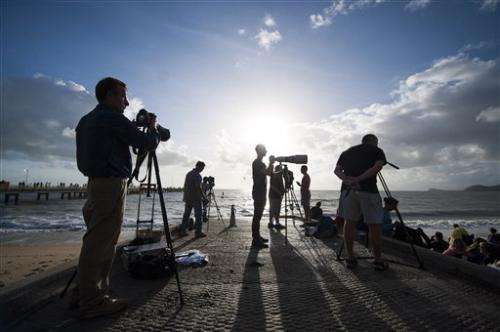
At what (x,y) coordinates should I click in order to perform the action: click on wheeled dolly. Please return your answer as a coordinate pair (x, y). The height and width of the screenshot is (332, 500). Looking at the image, I should click on (139, 222).